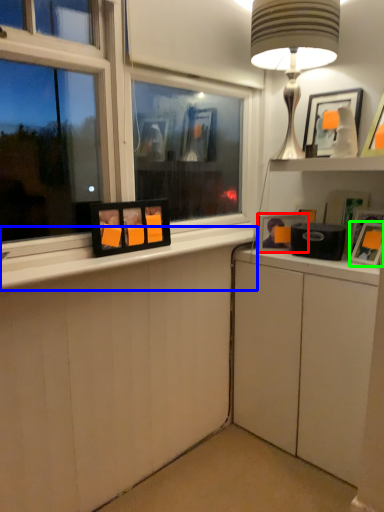
Question: Which object is the farthest from picture frame (highlighted by a red box)? Choose among these: window sill (highlighted by a blue box) or picture frame (highlighted by a green box).

Choices:
 (A) window sill
 (B) picture frame

Answer: (A)